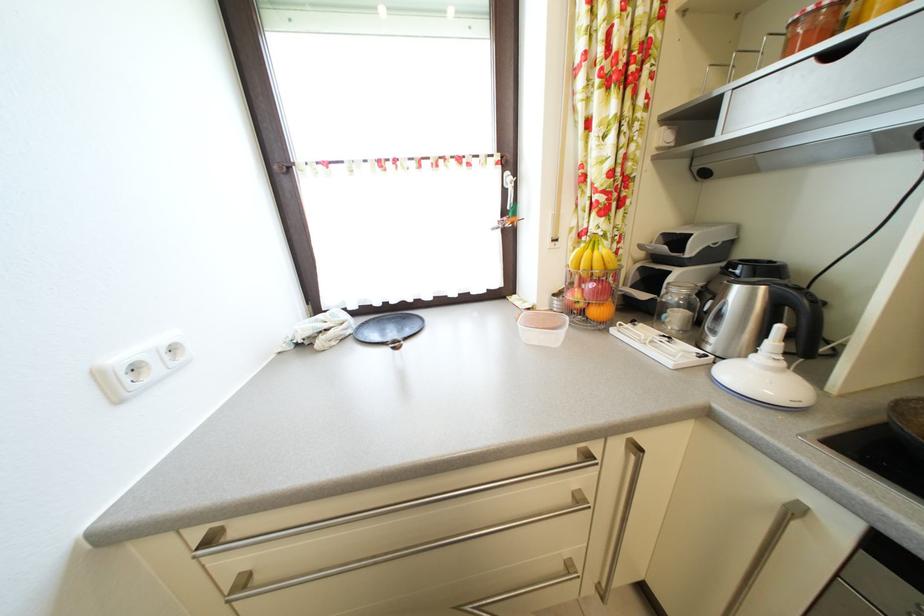
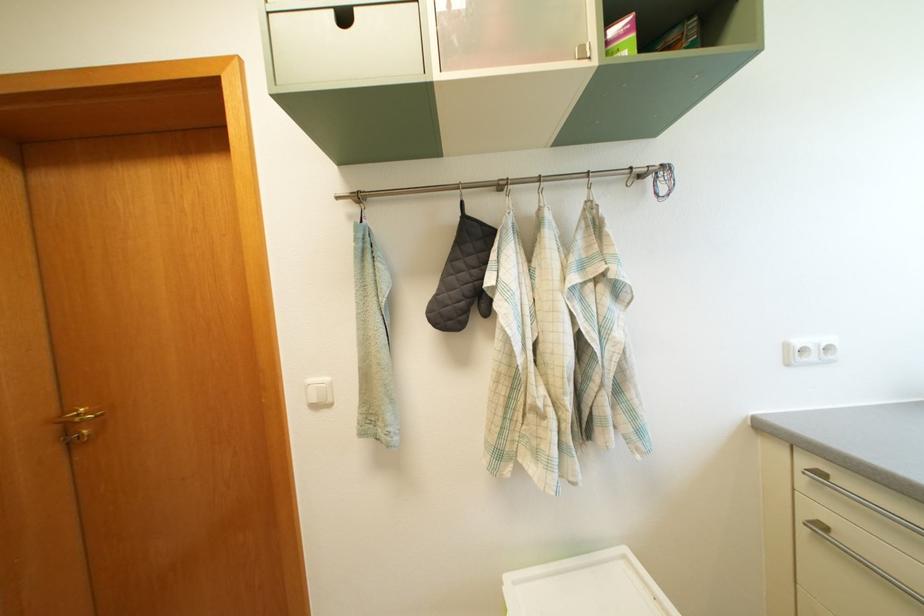
Where in the second image is the point corresponding to (x=106, y=381) from the first image?

(795, 353)